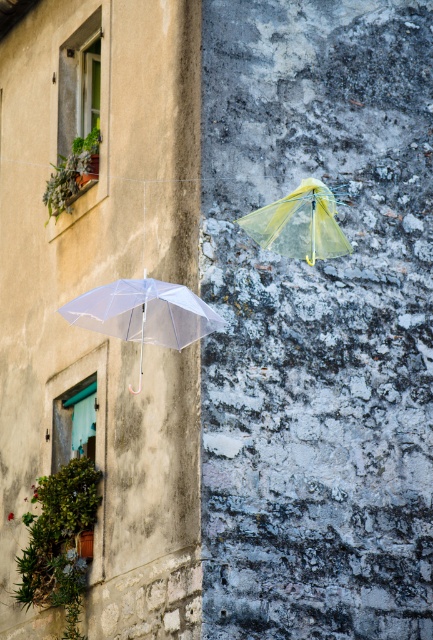
Question: Which of the following is the closest to the observer?

Choices:
 (A) transparent nylon umbrella at center
 (B) transparent plastic umbrella at lower left

Answer: (A)

Question: Can you confirm if transparent plastic umbrella at lower left is wider than transparent nylon umbrella at center?

Choices:
 (A) yes
 (B) no

Answer: (B)

Question: Can you confirm if transparent plastic umbrella at lower left is positioned to the right of transparent nylon umbrella at center?

Choices:
 (A) no
 (B) yes

Answer: (A)

Question: Among these objects, which one is nearest to the camera?

Choices:
 (A) transparent plastic umbrella at lower left
 (B) transparent nylon umbrella at center

Answer: (B)

Question: Is the position of transparent plastic umbrella at lower left less distant than that of transparent nylon umbrella at center?

Choices:
 (A) no
 (B) yes

Answer: (A)